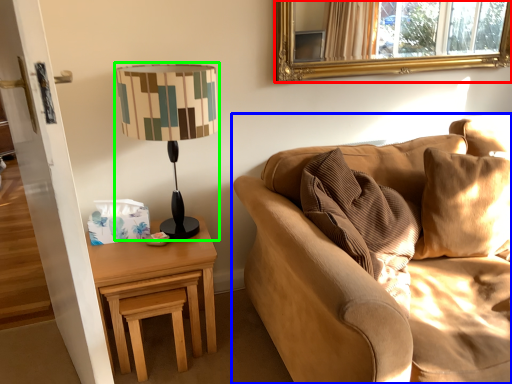
Question: Considering the real-world distances, which object is closest to mirror (highlighted by a red box)? studio couch (highlighted by a blue box) or lamp (highlighted by a green box).

Choices:
 (A) studio couch
 (B) lamp

Answer: (A)